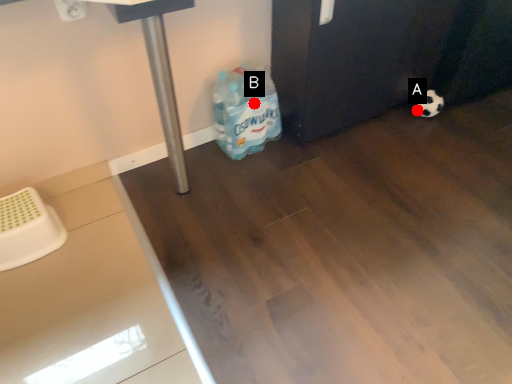
Question: Two points are circled on the image, labeled by A and B beside each circle. Which point appears closest to the camera in this image?

Choices:
 (A) A is closer
 (B) B is closer

Answer: (B)